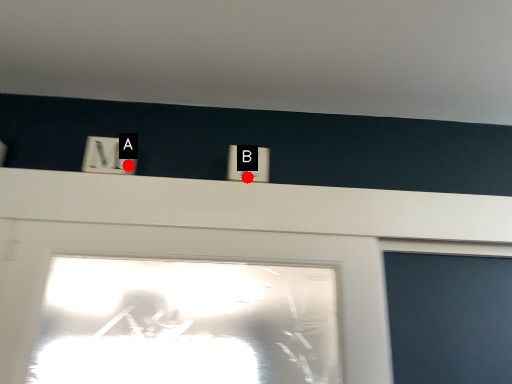
Question: Two points are circled on the image, labeled by A and B beside each circle. Which point appears closest to the camera in this image?

Choices:
 (A) A is closer
 (B) B is closer

Answer: (B)